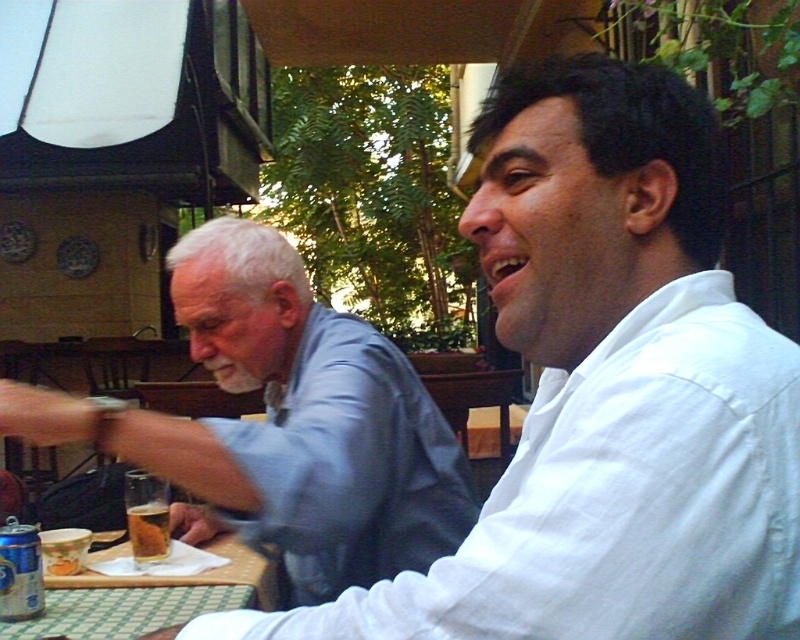
Is point (188, 445) behind point (68, 557)?

No, (188, 445) is closer to viewer.

From the picture: Is blue cotton shirt at upper left smaller than golden crispy fries at lower left?

Incorrect, blue cotton shirt at upper left is not smaller in size than golden crispy fries at lower left.

Who is more distant from viewer, (266, 326) or (54, 573)?

Point (266, 326)

Identify the location of blue cotton shirt at upper left. coord(284,424).

Based on the photo, does green checkered tablecloth at lower left appear under translucent glass beer at lower left?

Yes.

Can you confirm if green checkered tablecloth at lower left is wider than translucent glass beer at lower left?

Correct, the width of green checkered tablecloth at lower left exceeds that of translucent glass beer at lower left.

Identify the location of green checkered tablecloth at lower left. The image size is (800, 640). coord(148,596).

Between blue cotton shirt at upper left and translucent glass beer at lower left, which one is positioned higher?

blue cotton shirt at upper left is above.

How much distance is there between blue cotton shirt at upper left and translucent glass beer at lower left?

The distance of blue cotton shirt at upper left from translucent glass beer at lower left is 11.68 inches.

You are a GUI agent. You are given a task and a screenshot of the screen. Output one action in this format:
    pyautogui.click(x=<x>, y=<y>)
    Task: Click on the blue cotton shirt at upper left
    The height and width of the screenshot is (640, 800).
    Given the screenshot: What is the action you would take?
    pyautogui.click(x=284, y=424)